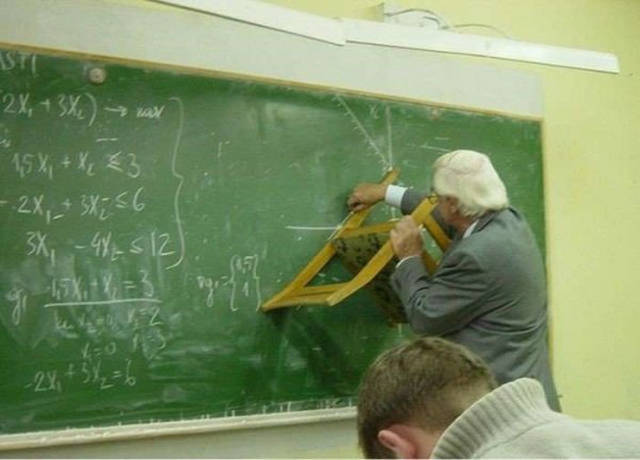
Locate an element on the screen. This screenshot has width=640, height=460. seat is located at coordinates (376, 286).